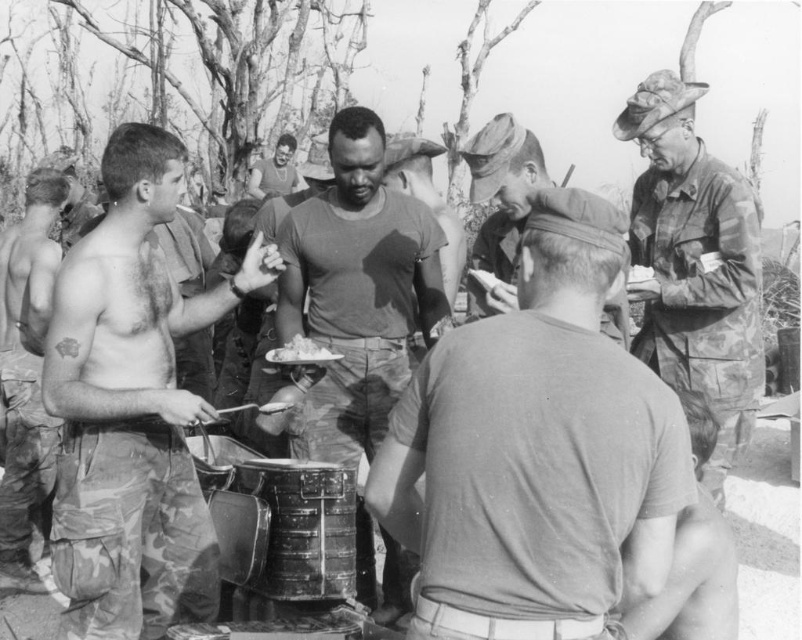
You are a photographer taking a picture of the soldiers. You need to ensure that the camouflage fabric shirt at left and the white paper plate at center are both clearly visible in the frame. Given their sizes, which object should you focus on to ensure both are in focus?

The camouflage fabric shirt at left is bigger than the white paper plate at center, so focusing on the camouflage fabric shirt at left will ensure both objects are in focus since it is larger and likely closer to the camera.

You are a photographer at the scene. You need to capture a photo where both the dark gray matte shirt at center and the camouflage uniform at center are visible. Which one will appear taller in the photo?

The dark gray matte shirt at center will appear taller in the photo because it has a greater height compared to the camouflage uniform at center.

You are a photographer at the scene and want to capture both the dark gray matte shirt at center and the camouflage uniform at center in a single frame. Given their sizes, which one should you focus on to ensure both are clearly visible in the photo?

Since the dark gray matte shirt at center is bigger than the camouflage uniform at center, you should focus on the dark gray matte shirt at center to ensure both are clearly visible in the photo.